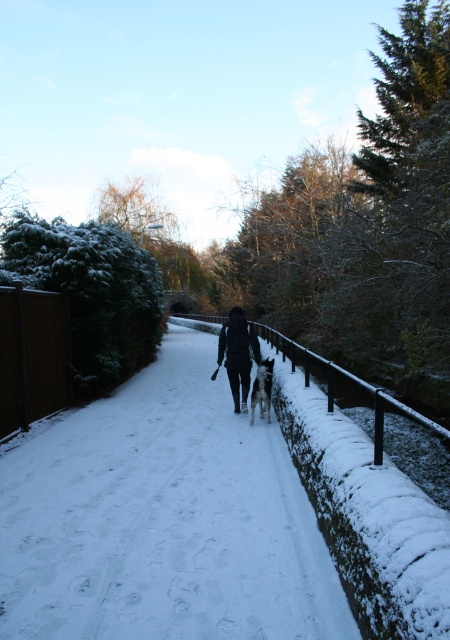
You are standing in the winter scene and want to take a photo of the white fur dog at center without the white snow at center appearing in the foreground. Is this possible based on their positions?

The white snow at center is closer to the viewer than the white fur dog at center, so the snow would block the dog in the foreground. Therefore, it is not possible to take a photo of the white fur dog at center without the white snow at center appearing in the foreground.

You are standing at the center of the image and want to place a small red flag exactly where the white snow at center is located. According to the coordinates provided, where should you place the flag?

You should place the red flag at the coordinates point (x=162, y=518) where the white snow at center is located.

You are a photographer trying to capture the person and their dog in the winter scene. Since you want to ensure both the black matte jacket at center and the white fur dog at center are clearly visible in your photo, which object should you focus on first to ensure proper exposure, considering their sizes?

The black matte jacket at center has a larger size compared to the white fur dog at center, so you should focus on the black matte jacket at center first to ensure proper exposure, as larger objects often require more attention in terms of lighting and focus to capture details effectively.